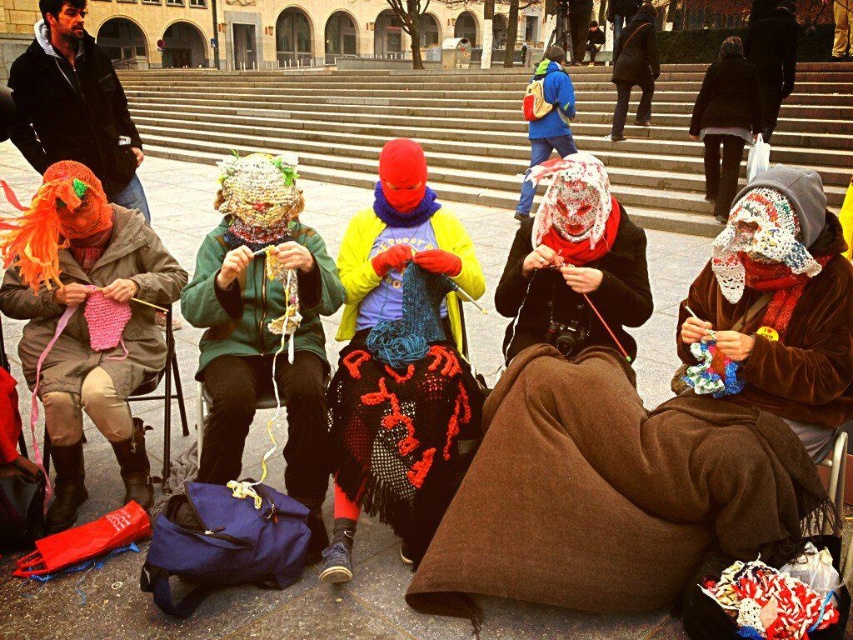
Question: Can you confirm if green knitted hat at center is thinner than blue fleece jacket at upper center?

Choices:
 (A) yes
 (B) no

Answer: (A)

Question: Among these objects, which one is nearest to the camera?

Choices:
 (A) yellow fleece jacket at center
 (B) white lace mask at center
 (C) velvet brown coat at lower right

Answer: (A)

Question: Estimate the real-world distances between objects in this image. Which object is farther from the velvet brown coat at lower right?

Choices:
 (A) blue fleece jacket at upper center
 (B) white lace mask at center
 (C) dark brown coat at upper center
 (D) green knitted hat at center

Answer: (C)

Question: Does orange knitted hat at left appear on the right side of blue fleece jacket at upper center?

Choices:
 (A) yes
 (B) no

Answer: (B)

Question: Does green knitted hat at center have a greater width compared to knitted scarf at center?

Choices:
 (A) yes
 (B) no

Answer: (A)

Question: Which of the following is the farthest from the observer?

Choices:
 (A) (386, 472)
 (B) (170, 276)
 (C) (641, 84)

Answer: (C)